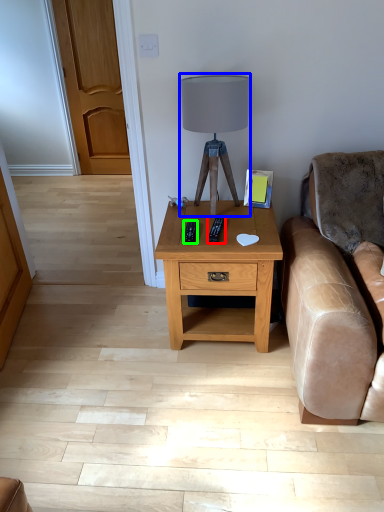
Question: Which object is positioned farthest from remote (highlighted by a red box)? Select from table lamp (highlighted by a blue box) and remote (highlighted by a green box).

Choices:
 (A) table lamp
 (B) remote

Answer: (A)